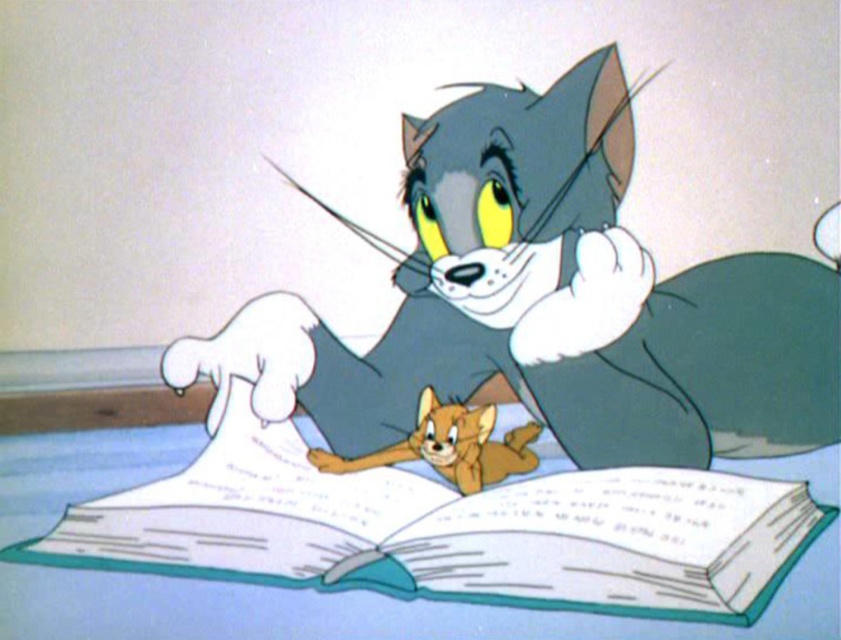
You are a photographer standing at the camera position. You want to take a closeup photo of the gray fur cat at center. The camera lens has a minimum focusing distance of 1.5 meters. Can you take the photo without moving the camera or the cat?

The gray fur cat at center is 1.63 meters from camera, which is beyond the minimum focusing distance of 1.5 meters. Therefore, you can take the closeup photo without moving the camera or the cat.

Based on the scene description, can you determine which object is bigger between the white paper book at center and the orange fur cat at center?

The white paper book at center is larger in size than the orange fur cat at center.